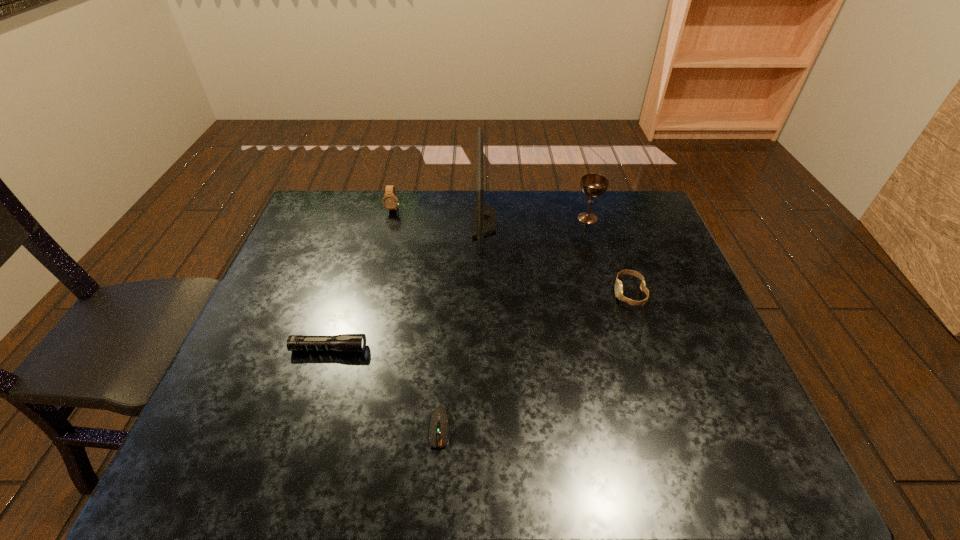
I want to click on the fourth object from right to left, so click(440, 418).

Find the location of a particular element. free space located 0.210m on the screen side of the tallest object is located at coordinates (408, 221).

Where is `free space located on the screen side of the tallest object`? free space located on the screen side of the tallest object is located at coordinates (433, 221).

You are a GUI agent. You are given a task and a screenshot of the screen. Output one action in this format:
    pyautogui.click(x=<x>, y=<y>)
    Task: Click on the vacant area located 0.210m on the screen side of the tallest object
    
    Given the screenshot: What is the action you would take?
    pyautogui.click(x=408, y=221)

At what (x,y) coordinates should I click in order to perform the action: click on free space located on the right of the second tallest object. Please return your answer as a coordinate pair (x, y). Image resolution: width=960 pixels, height=540 pixels. Looking at the image, I should click on (639, 218).

Find the location of a particular element. The width and height of the screenshot is (960, 540). vacant space located 0.120m on the face of the farther watch is located at coordinates (387, 236).

Identify the location of vacant area situated on the face of the right watch. The height and width of the screenshot is (540, 960). (548, 293).

Where is `free spot located 0.190m on the face of the right watch`? free spot located 0.190m on the face of the right watch is located at coordinates (545, 293).

This screenshot has height=540, width=960. I want to click on free space located on the face of the right watch, so click(x=541, y=293).

The height and width of the screenshot is (540, 960). In order to click on vacant space positioned 0.400m at the lens end of the flashlight in this screenshot , I will do `click(530, 349)`.